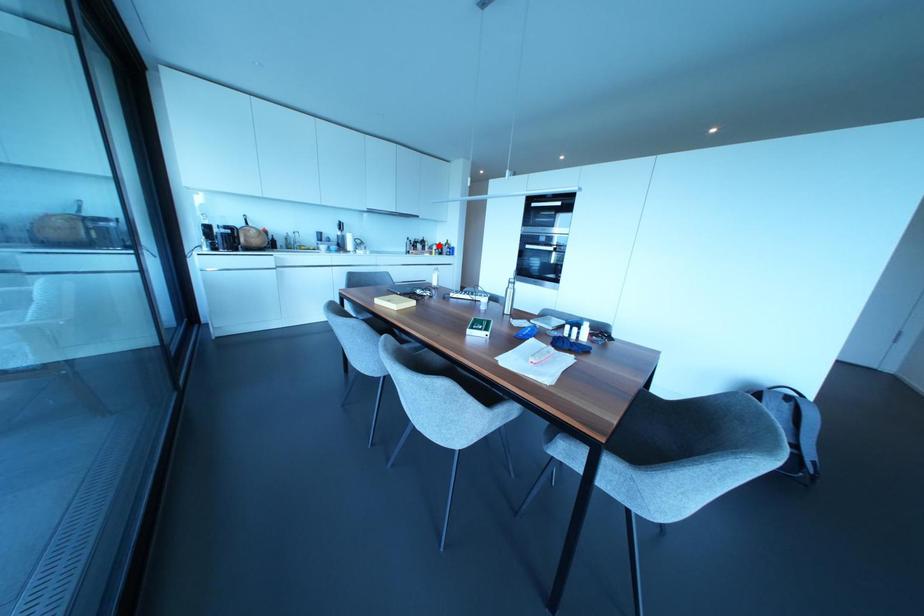
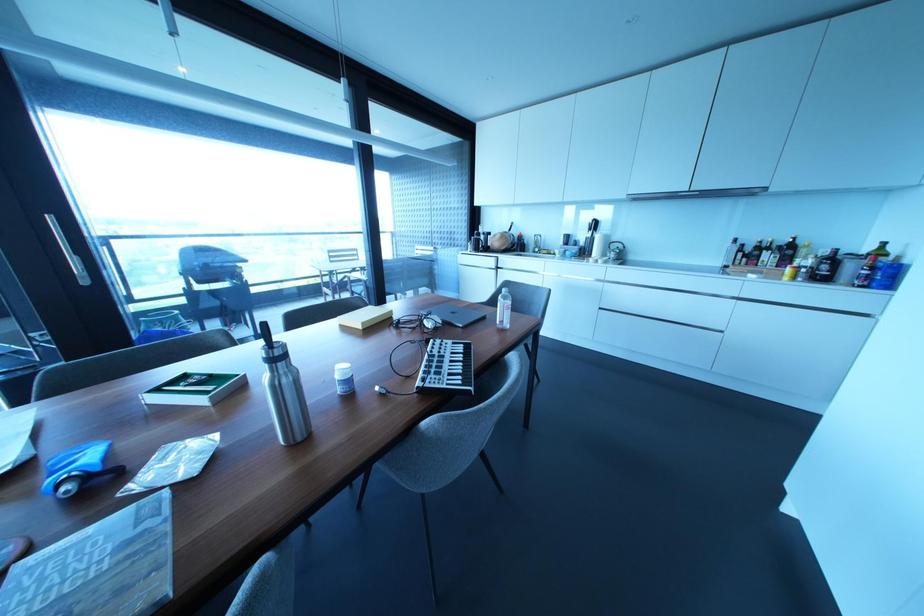
In the second image, find the point that corresponds to the highlighted location in the first image.

(833, 257)